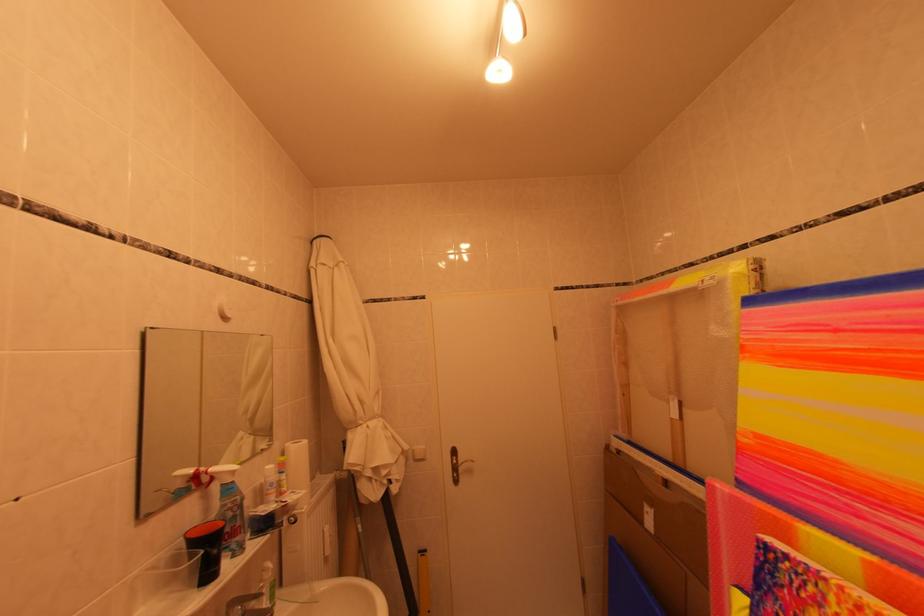
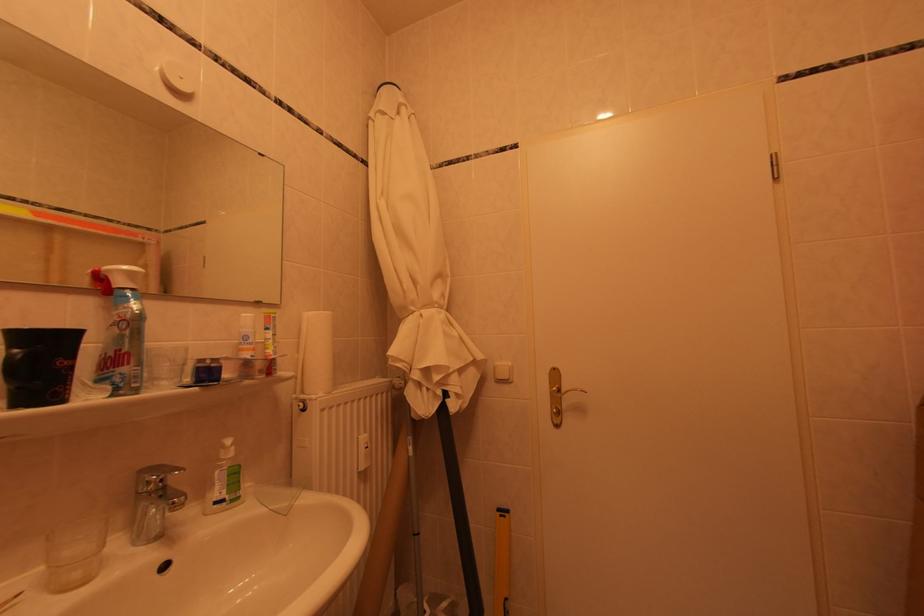
Locate, in the second image, the point that corresponds to pixel 424 451 in the first image.

(506, 367)